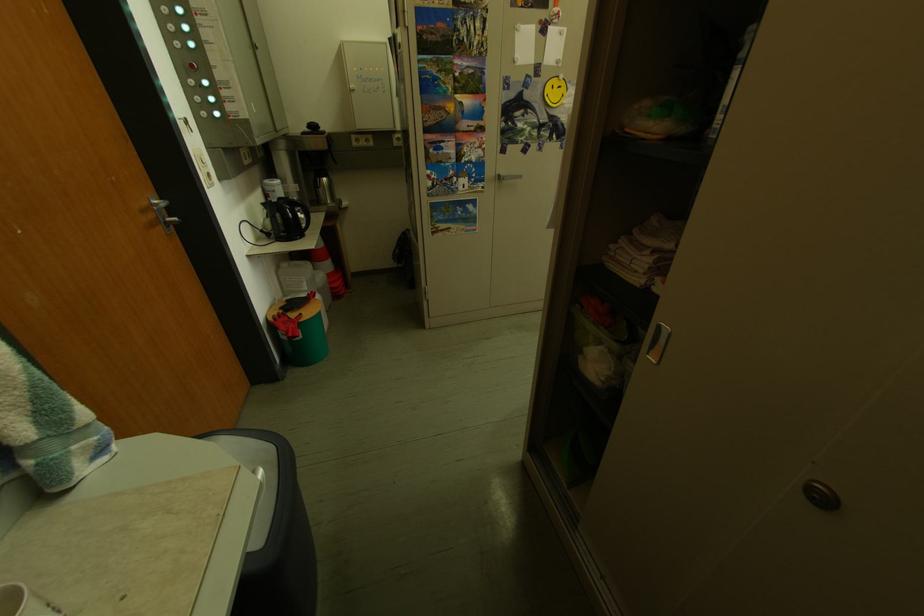
Identify the location of white panel button. (367, 99).